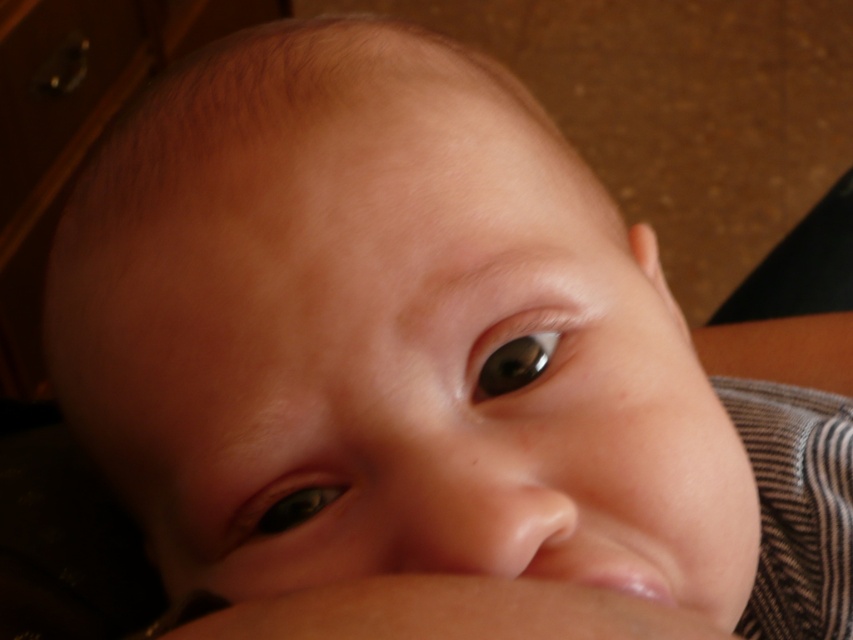
Measure the distance between point [289,506] and camera.

A distance of 10.79 inches exists between point [289,506] and camera.

Is the position of green glossy eye at lower left more distant than that of brown glossy eye at upper center?

Yes.

Does point (305, 493) come behind point (471, 358)?

Yes, point (305, 493) is farther from viewer.

This screenshot has width=853, height=640. In order to click on green glossy eye at lower left in this screenshot , I will do `click(288, 502)`.